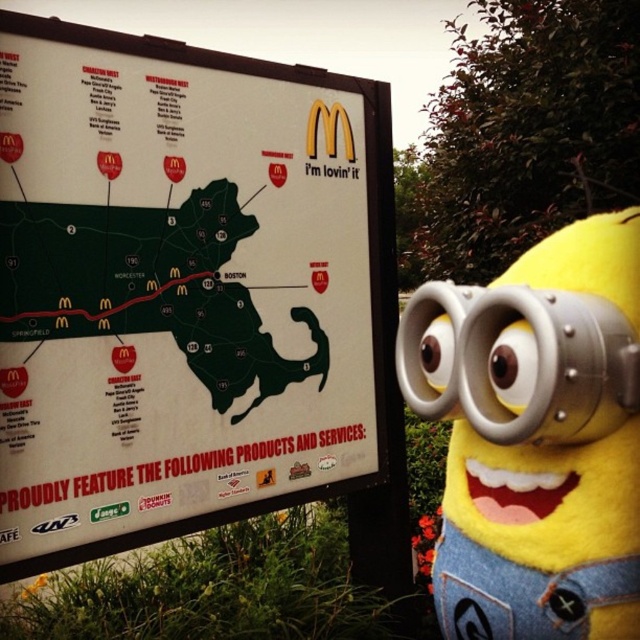
Is white paper map at upper center behind green matte map at center?

No, white paper map at upper center is in front of green matte map at center.

Is white paper map at upper center closer to the viewer compared to green matte map at center?

Yes, it is in front of green matte map at center.

Find the location of a particular element. white paper map at upper center is located at coordinates (177, 291).

Between white paper map at upper center and silver metallic goggles at center, which one has less height?

Standing shorter between the two is silver metallic goggles at center.

Locate an element on the screen. The height and width of the screenshot is (640, 640). white paper map at upper center is located at coordinates (177, 291).

Between green matte map at center and silver metallic goggles at center, which one appears on the left side from the viewer's perspective?

green matte map at center

Can you confirm if green matte map at center is taller than silver metallic goggles at center?

Yes.

Describe the element at coordinates (148, 285) in the screenshot. This screenshot has width=640, height=640. I see `green matte map at center` at that location.

Image resolution: width=640 pixels, height=640 pixels. What are the coordinates of `green matte map at center` in the screenshot? It's located at click(x=148, y=285).